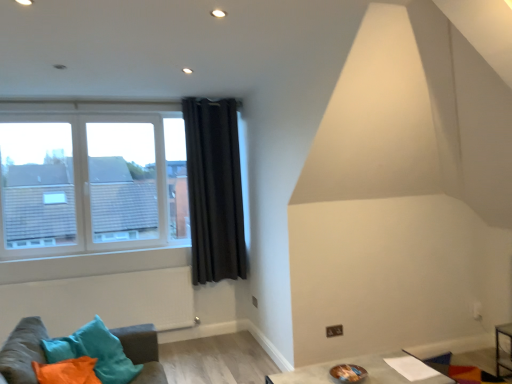
Question: Is clear glass window at left inside or outside of velvet teal cushions at lower left?

Choices:
 (A) inside
 (B) outside

Answer: (B)

Question: Is clear glass window at left bigger or smaller than velvet teal cushions at lower left?

Choices:
 (A) big
 (B) small

Answer: (A)

Question: Estimate the real-world distances between objects in this image. Which object is closer to the smooth gray table at lower center?

Choices:
 (A) velvet teal cushions at lower left
 (B) clear glass window at left
 (C) black velvet curtain at upper center

Answer: (A)

Question: Based on their relative distances, which object is nearer to the velvet teal cushions at lower left?

Choices:
 (A) black velvet curtain at upper center
 (B) clear glass window at left
 (C) smooth gray table at lower center

Answer: (C)